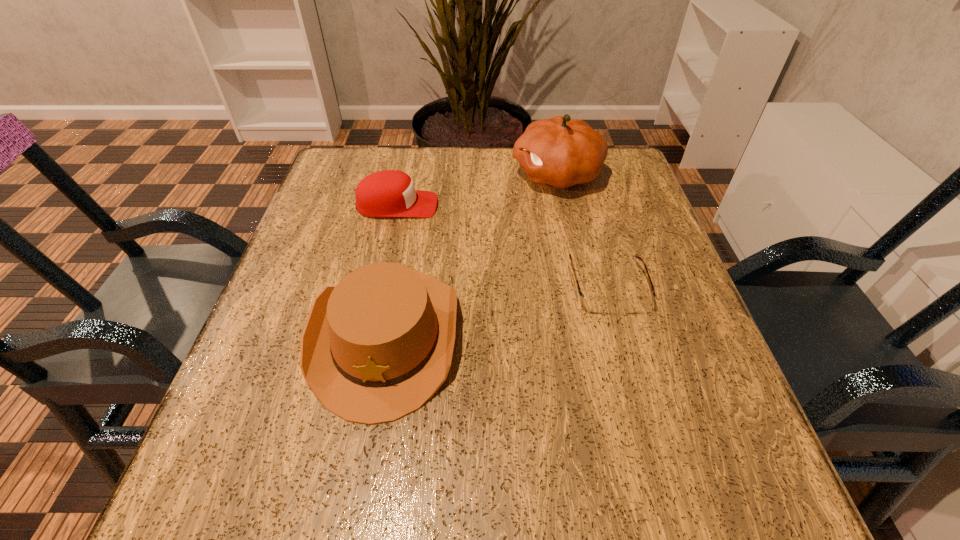
Identify the location of free space between the spectacles and the pumpkin. This screenshot has width=960, height=540. (582, 231).

Where is `free space between the tallest object and the second shortest object`? Image resolution: width=960 pixels, height=540 pixels. free space between the tallest object and the second shortest object is located at coordinates (477, 190).

Where is `free spot between the second tallest object and the shortest object`? The image size is (960, 540). free spot between the second tallest object and the shortest object is located at coordinates (496, 312).

Image resolution: width=960 pixels, height=540 pixels. I want to click on object that is the closest to the shortest object, so click(x=560, y=151).

Where is `the closest object to the spectacles`? Image resolution: width=960 pixels, height=540 pixels. the closest object to the spectacles is located at coordinates (560, 151).

The height and width of the screenshot is (540, 960). I want to click on vacant space that satisfies the following two spatial constraints: 1. on the front face of the pumpkin; 2. on the front-facing side of the third shortest object, so click(591, 335).

Locate an element on the screen. Image resolution: width=960 pixels, height=540 pixels. free space that satisfies the following two spatial constraints: 1. on the front face of the tallest object; 2. on the front-facing side of the third shortest object is located at coordinates (591, 335).

The width and height of the screenshot is (960, 540). What are the coordinates of `vacant space that satisfies the following two spatial constraints: 1. on the front face of the pumpkin; 2. on the front-facing side of the cowboy hat` in the screenshot? It's located at (591, 335).